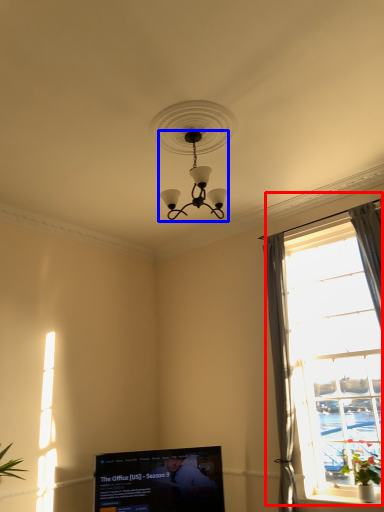
Question: Which point is further to the camera, window (highlighted by a red box) or lamp (highlighted by a blue box)?

Choices:
 (A) window
 (B) lamp

Answer: (A)